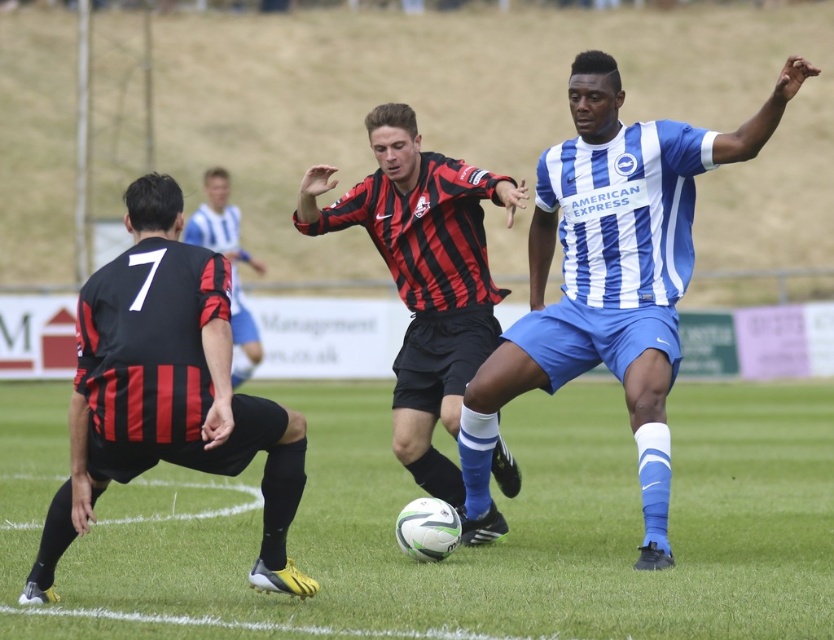
You are a soccer coach analyzing the field. You notice the green grass at center and the blue striped jersey at center. How far apart are these two elements from each other?

The green grass at center and the blue striped jersey at center are 11.76 feet apart from each other.

You are a soccer referee observing the field. You notice the green grass at center and the red and black striped jersey at center. Which object is wider in this scene?

The green grass at center is wider than the red and black striped jersey at center according to the description.